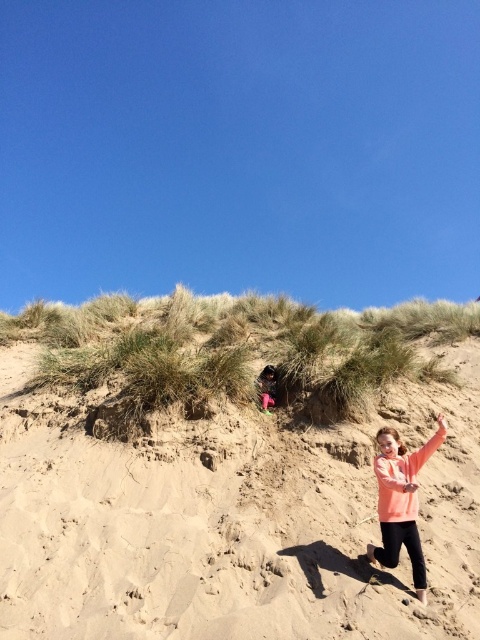
Question: Is matte peach hoodie at lower right to the left of pink fabric at center from the viewer's perspective?

Choices:
 (A) yes
 (B) no

Answer: (B)

Question: Which of these objects is positioned closest to the matte peach hoodie at lower right?

Choices:
 (A) green grassy hillside at upper center
 (B) pink fabric at center

Answer: (A)

Question: Which point is closer to the camera?

Choices:
 (A) (255, 380)
 (B) (382, 561)
 (C) (444, 593)

Answer: (C)

Question: Which object is positioned closest to the green grassy hillside at upper center?

Choices:
 (A) pink fabric at center
 (B) matte peach hoodie at lower right

Answer: (B)

Question: Is matte peach hoodie at lower right positioned at the back of pink fabric at center?

Choices:
 (A) yes
 (B) no

Answer: (B)

Question: Does green grassy hillside at upper center have a smaller size compared to matte peach hoodie at lower right?

Choices:
 (A) no
 (B) yes

Answer: (A)